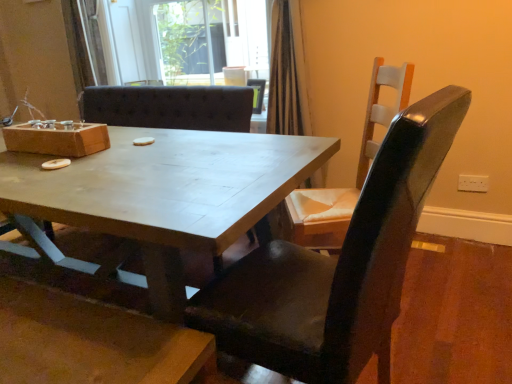
Identify the location of free space in front of wooden box at upper left. The image size is (512, 384). (50, 171).